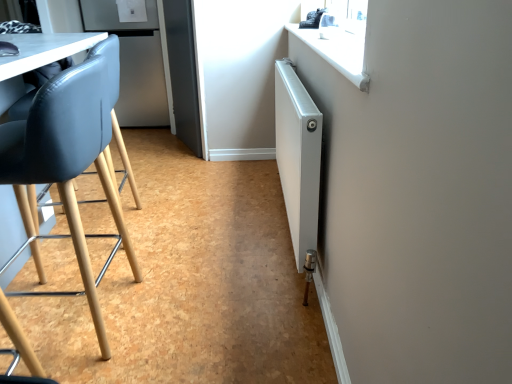
You are a GUI agent. You are given a task and a screenshot of the screen. Output one action in this format:
    pyautogui.click(x=<x>, y=<y>)
    Task: Click on the free space in front of white metallic radiator at right
    
    Given the screenshot: What is the action you would take?
    pyautogui.click(x=239, y=296)